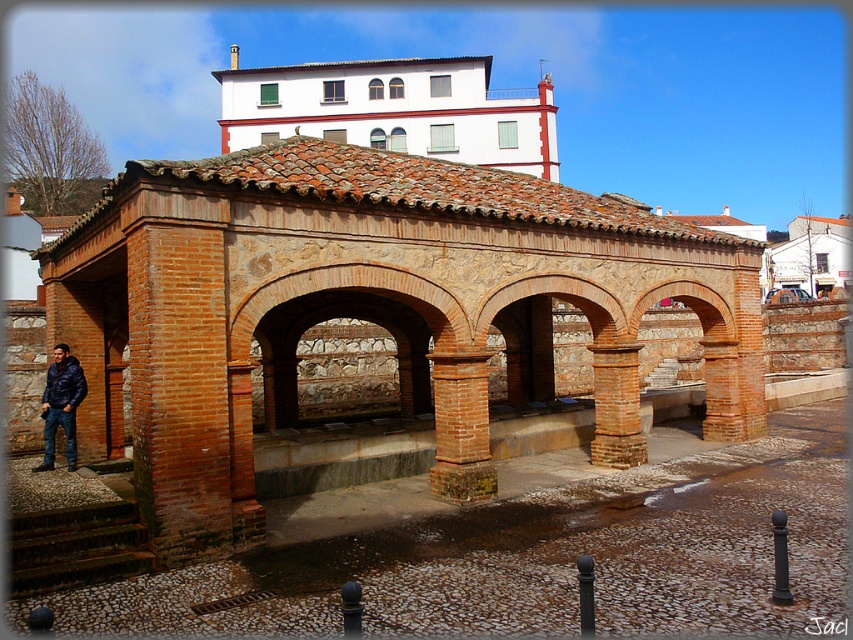
Can you confirm if brick at center is positioned to the left of dark blue leather jacket at lower left?

In fact, brick at center is to the right of dark blue leather jacket at lower left.

Based on the photo, who is more forward, [466,496] or [55,390]?

Point [466,496]

Find the location of a particular element. This screenshot has height=640, width=853. brick at center is located at coordinates (461, 428).

This screenshot has width=853, height=640. I want to click on brick at center, so click(x=461, y=428).

Who is more forward, (474, 355) or (599, 458)?

Point (474, 355) is in front.

Locate an element on the screen. brick at center is located at coordinates (461, 428).

At what (x,y) coordinates should I click in order to perform the action: click on brick at center. Please return your answer as a coordinate pair (x, y). The image size is (853, 640). Looking at the image, I should click on (461, 428).

Find the location of a particular element. Image resolution: width=853 pixels, height=640 pixels. brick column at center is located at coordinates (616, 404).

Does point (631, 374) come in front of point (59, 394)?

No, it is behind (59, 394).

What do you see at coordinates (616, 404) in the screenshot? This screenshot has width=853, height=640. I see `brick column at center` at bounding box center [616, 404].

Locate an element on the screen. This screenshot has height=640, width=853. brick column at center is located at coordinates (616, 404).